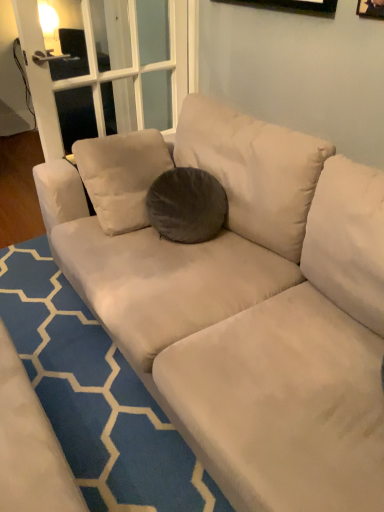
Question: From the image's perspective, is wooden frame at upper right below blue textured rug at center?

Choices:
 (A) yes
 (B) no

Answer: (B)

Question: Is wooden frame at upper right at the left side of blue textured rug at center?

Choices:
 (A) yes
 (B) no

Answer: (B)

Question: From the image's perspective, does wooden frame at upper right appear higher than blue textured rug at center?

Choices:
 (A) yes
 (B) no

Answer: (A)

Question: Does wooden frame at upper right come in front of blue textured rug at center?

Choices:
 (A) yes
 (B) no

Answer: (B)

Question: Is wooden frame at upper right completely or partially outside of blue textured rug at center?

Choices:
 (A) no
 (B) yes

Answer: (B)

Question: From a real-world perspective, does wooden frame at upper right stand above blue textured rug at center?

Choices:
 (A) no
 (B) yes

Answer: (B)

Question: From a real-world perspective, is wooden frame at upper right beneath dark gray velvety pillow at center?

Choices:
 (A) yes
 (B) no

Answer: (B)

Question: Can you confirm if wooden frame at upper right is shorter than dark gray velvety pillow at center?

Choices:
 (A) no
 (B) yes

Answer: (B)

Question: From the image's perspective, is wooden frame at upper right on top of dark gray velvety pillow at center?

Choices:
 (A) no
 (B) yes

Answer: (B)

Question: Is wooden frame at upper right thinner than dark gray velvety pillow at center?

Choices:
 (A) no
 (B) yes

Answer: (B)

Question: Does wooden frame at upper right have a larger size compared to dark gray velvety pillow at center?

Choices:
 (A) no
 (B) yes

Answer: (A)

Question: Considering the relative sizes of wooden frame at upper right and dark gray velvety pillow at center in the image provided, is wooden frame at upper right wider than dark gray velvety pillow at center?

Choices:
 (A) no
 (B) yes

Answer: (A)

Question: Is blue textured rug at center oriented away from dark gray velvety pillow at center?

Choices:
 (A) yes
 (B) no

Answer: (B)